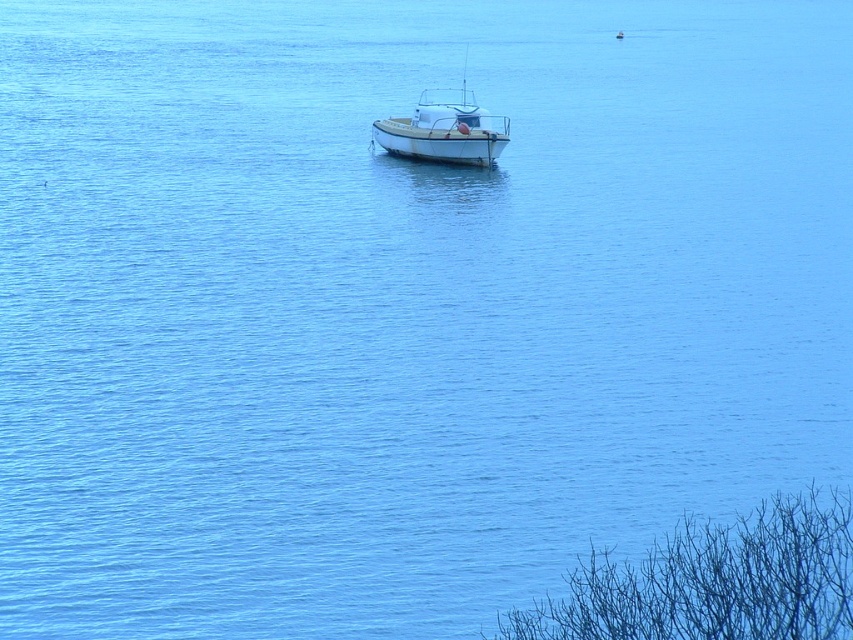
Is bare branches at lower right wider than white matte boat at center?

Yes.

Which is in front, point (532, 611) or point (390, 140)?

Point (532, 611) is more forward.

Who is more distant from viewer, (688, 561) or (393, 147)?

The point (393, 147) is behind.

Locate an element on the screen. bare branches at lower right is located at coordinates click(712, 580).